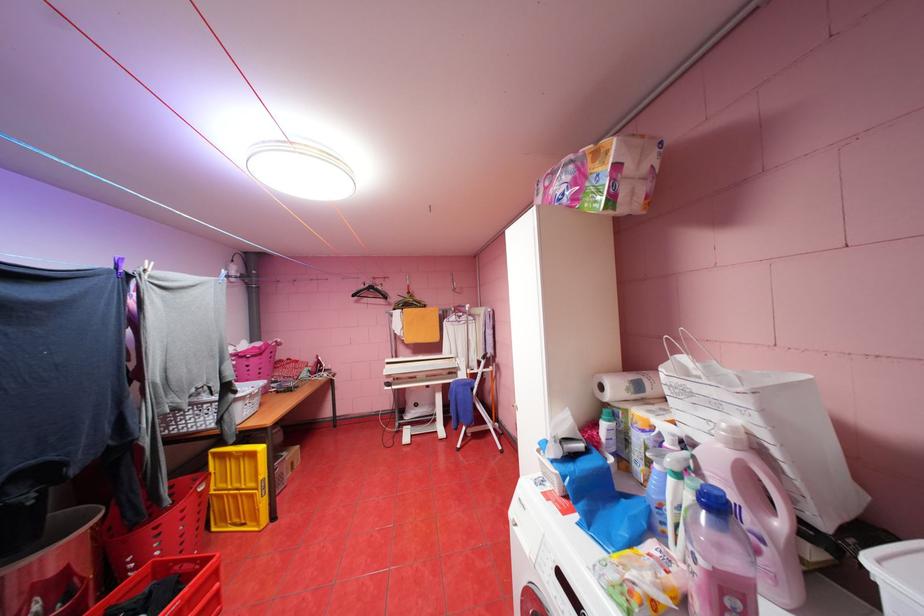
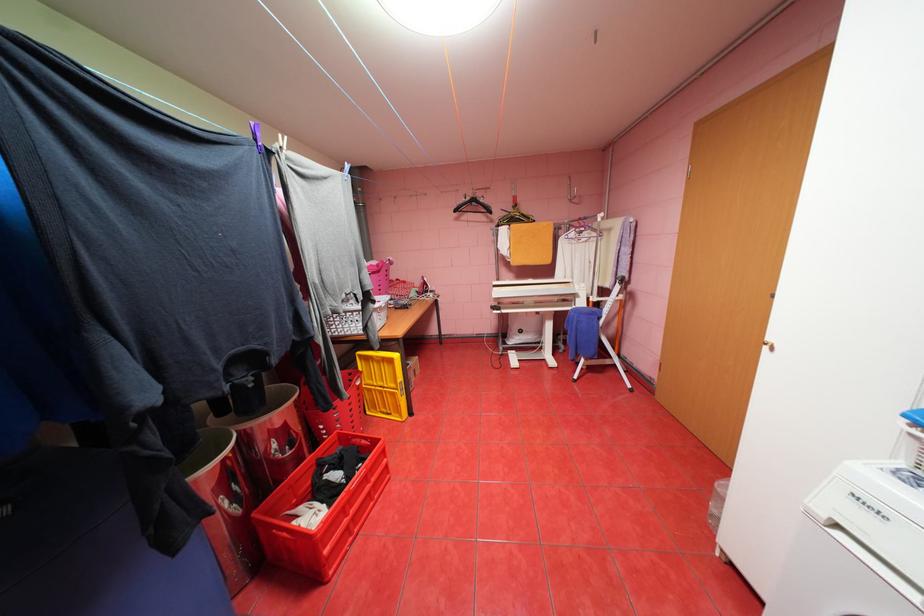
The point at (361, 294) is marked in the first image. Where is the corresponding point in the second image?

(464, 209)